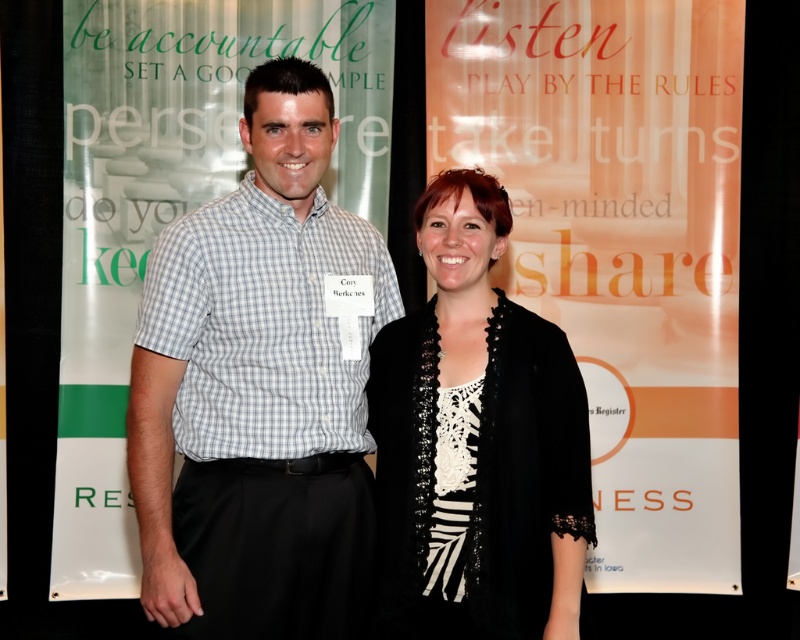
Question: In this image, where is checkered fabric shirt at center located relative to black lace top at center?

Choices:
 (A) above
 (B) below

Answer: (A)

Question: Does checkered fabric shirt at center appear over black lace top at center?

Choices:
 (A) yes
 (B) no

Answer: (A)

Question: Which point is closer to the camera?

Choices:
 (A) (389, 477)
 (B) (346, 268)

Answer: (A)

Question: Which object appears farthest from the camera in this image?

Choices:
 (A) checkered fabric shirt at center
 (B) black lace top at center

Answer: (A)

Question: Observing the image, what is the correct spatial positioning of checkered fabric shirt at center in reference to black lace top at center?

Choices:
 (A) right
 (B) left

Answer: (B)